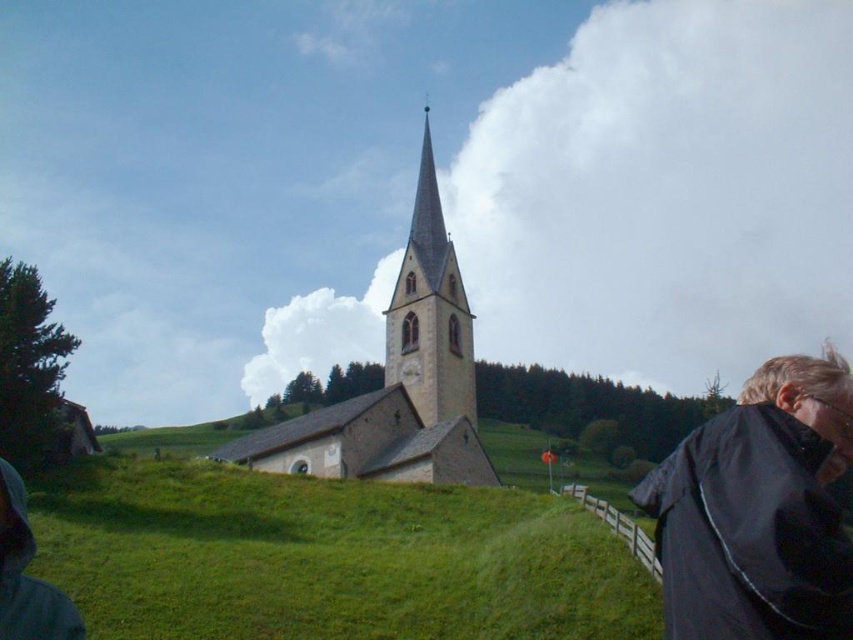
Between green grassy hillside at center and stone church steeple at center, which one is positioned higher?

stone church steeple at center is above.

Can you confirm if green grassy hillside at center is bigger than stone church steeple at center?

No.

Does point (418, 563) come in front of point (410, 284)?

Yes, point (418, 563) is in front of point (410, 284).

Where is `green grassy hillside at center`? green grassy hillside at center is located at coordinates 328,557.

Consider the image. Does black matte jacket at lower right appear over stone church steeple at center?

No.

Can you confirm if black matte jacket at lower right is bigger than stone church steeple at center?

Incorrect, black matte jacket at lower right is not larger than stone church steeple at center.

Between point (814, 452) and point (444, 449), which one is positioned behind?

The point (444, 449) is behind.

This screenshot has width=853, height=640. Find the location of `black matte jacket at lower right`. black matte jacket at lower right is located at coordinates (759, 509).

Does black matte jacket at lower right have a greater height compared to smooth stone tower at center?

No.

Who is more distant from viewer, (x=744, y=554) or (x=428, y=224)?

Positioned behind is point (x=428, y=224).

At what (x,y) coordinates should I click in order to perform the action: click on black matte jacket at lower right. Please return your answer as a coordinate pair (x, y). This screenshot has height=640, width=853. Looking at the image, I should click on (759, 509).